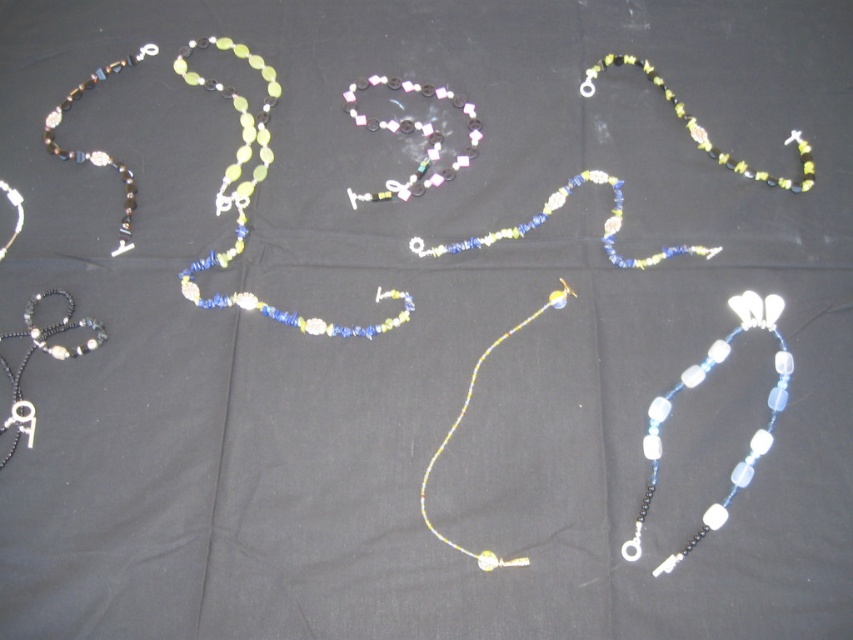
Is translucent yellow glass beads at center positioned behind matte black necklace at lower left?

Yes, it is.

From the picture: Can you confirm if translucent yellow glass beads at center is positioned to the right of matte black necklace at lower left?

Indeed, translucent yellow glass beads at center is positioned on the right side of matte black necklace at lower left.

Is point (236, 214) positioned in front of point (41, 326)?

No, it is behind (41, 326).

Locate an element on the screen. The width and height of the screenshot is (853, 640). translucent yellow glass beads at center is located at coordinates (250, 196).

Based on the photo, which of these two, translucent yellow glass beads at center or translucent plastic beads at center, stands shorter?

Standing shorter between the two is translucent plastic beads at center.

Can you confirm if translucent yellow glass beads at center is wider than translucent plastic beads at center?

Yes, translucent yellow glass beads at center is wider than translucent plastic beads at center.

Is point (238, 228) farther from camera compared to point (434, 134)?

No, (238, 228) is closer to viewer.

The image size is (853, 640). What are the coordinates of `translucent yellow glass beads at center` in the screenshot? It's located at (250, 196).

Can you confirm if matte black necklace at lower left is taller than translucent yellow-green beads at upper right?

No.

Between matte black necklace at lower left and translucent yellow-green beads at upper right, which one has more height?

translucent yellow-green beads at upper right is taller.

The image size is (853, 640). Identify the location of matte black necklace at lower left. (45, 353).